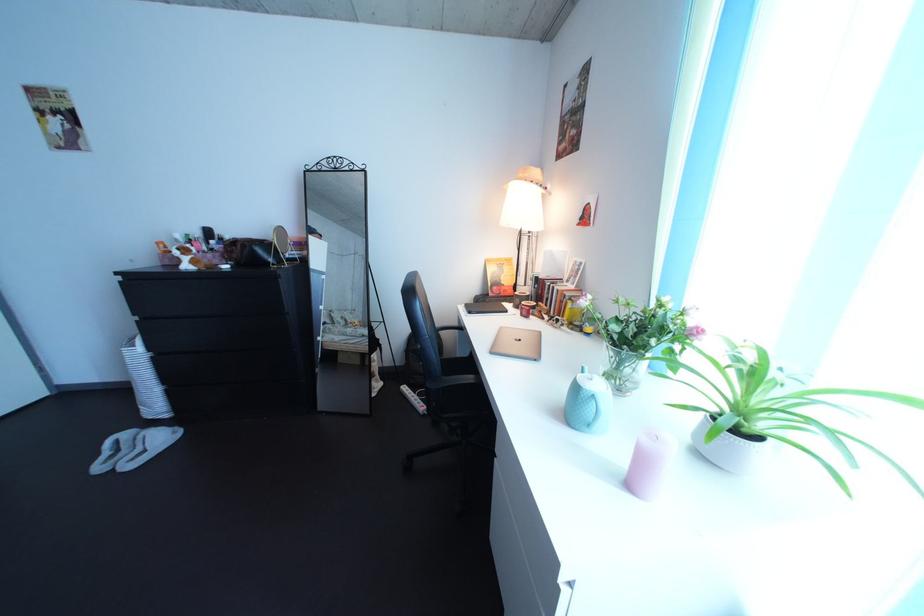
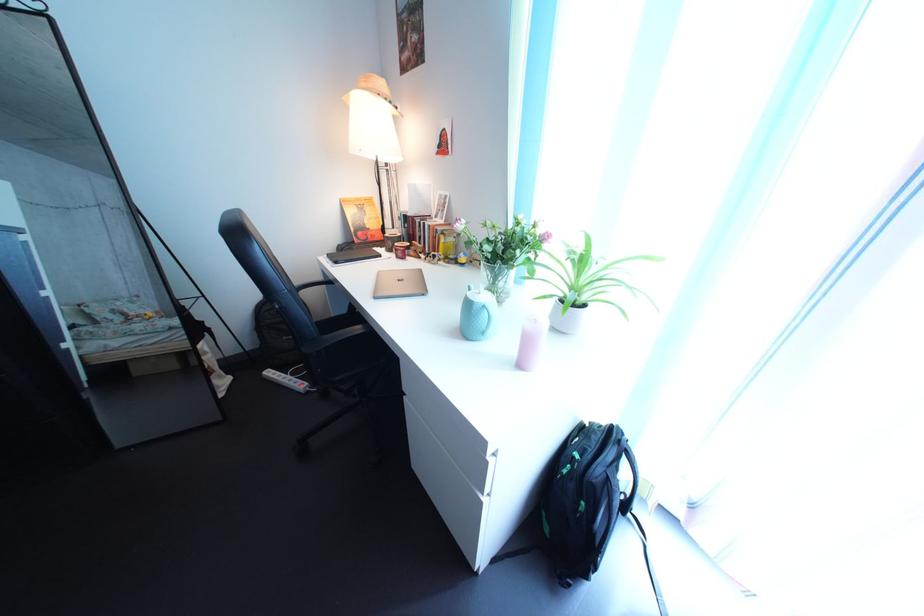
Question: How did the camera likely rotate?

Choices:
 (A) Left
 (B) Right
 (C) Up
 (D) Down

Answer: (B)